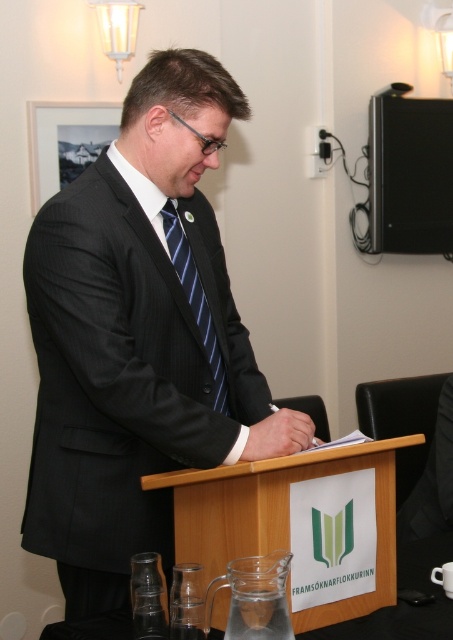
Does black pinstripe suit at center appear over wooden podium at center?

Indeed, black pinstripe suit at center is positioned over wooden podium at center.

In the scene shown: Which is above, black pinstripe suit at center or wooden podium at center?

black pinstripe suit at center

Locate an element on the screen. This screenshot has width=453, height=640. black pinstripe suit at center is located at coordinates (139, 337).

Locate an element on the screen. black pinstripe suit at center is located at coordinates (139, 337).

Between black pinstripe suit at center and blue striped tie at center, which one is positioned higher?

blue striped tie at center

Can you confirm if black pinstripe suit at center is bigger than blue striped tie at center?

Indeed, black pinstripe suit at center has a larger size compared to blue striped tie at center.

Is point (126, 445) farther from camera compared to point (183, 236)?

That is False.

This screenshot has width=453, height=640. I want to click on black pinstripe suit at center, so click(x=139, y=337).

Does wooden podium at center have a greater height compared to blue striped tie at center?

In fact, wooden podium at center may be shorter than blue striped tie at center.

Is point (326, 452) closer to camera compared to point (192, 266)?

Yes, point (326, 452) is closer to viewer.

Where is `wooden podium at center`? The width and height of the screenshot is (453, 640). wooden podium at center is located at coordinates (279, 515).